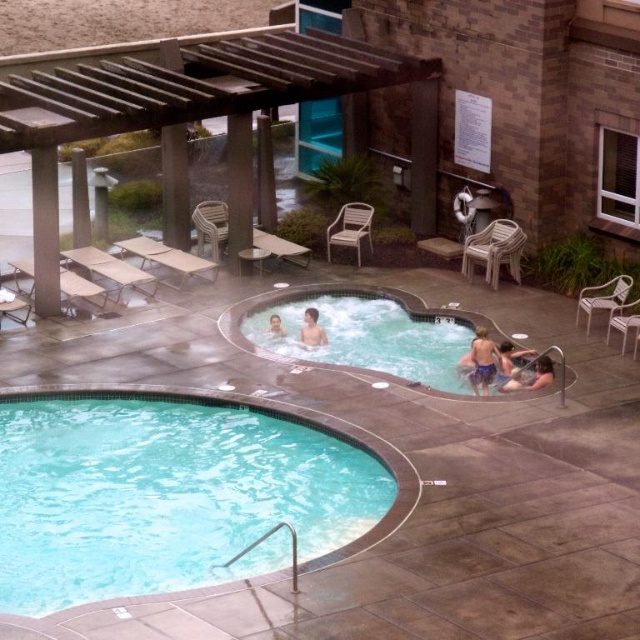
You are a guest at the spa and want to take a photo of the smooth skin boy at upper center without the white glossy hot tub at center appearing in the background. Is this possible given their positions?

The white glossy hot tub at center is in front of the smooth skin boy at upper center, so the hot tub would block the view of the boy. Therefore, it is not possible to take a photo of the smooth skin boy at upper center without the hot tub appearing in the background.

You are standing at the center of the spa area and want to retrieve your blue fabric shorts at lower right. According to the coordinates provided, in which direction should you move to reach them?

The blue fabric shorts at lower right are located at coordinates point (481, 360). Since you are at the center, you should move towards the lower right direction to reach them.